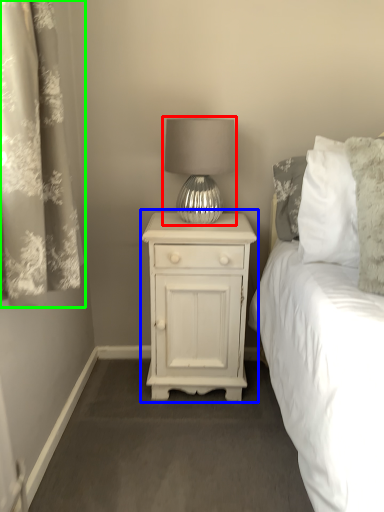
Question: Considering the real-world distances, which object is closest to lamp (highlighted by a red box)? nightstand (highlighted by a blue box) or curtain (highlighted by a green box).

Choices:
 (A) nightstand
 (B) curtain

Answer: (A)